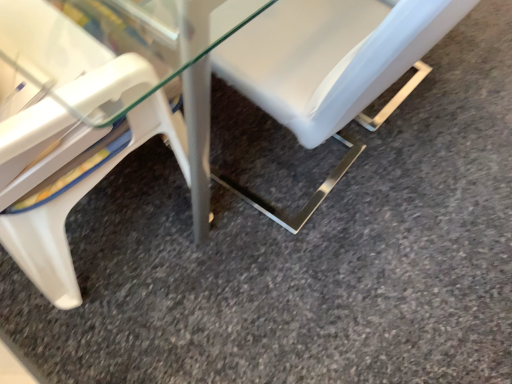
Describe the element at coordinates (68, 179) in the screenshot. The width and height of the screenshot is (512, 384). I see `white plastic chair at lower left, the 2th chair in the right-to-left sequence` at that location.

Identify the location of white plastic chair at lower left, which is the 1th chair from left to right. (68, 179).

Where is `white plastic chair at center, which is the first chair in right-to-left order`? The image size is (512, 384). white plastic chair at center, which is the first chair in right-to-left order is located at coordinates (330, 69).

The image size is (512, 384). Describe the element at coordinates (330, 69) in the screenshot. I see `white plastic chair at center, which is the first chair in right-to-left order` at that location.

The width and height of the screenshot is (512, 384). In order to click on white plastic chair at lower left, the 2th chair in the right-to-left sequence in this screenshot , I will do `click(68, 179)`.

Based on the photo, between white plastic chair at lower left, the 2th chair in the right-to-left sequence, and white plastic chair at center, the 2th chair viewed from the left, which one appears on the right side from the viewer's perspective?

Positioned to the right is white plastic chair at center, the 2th chair viewed from the left.

Considering the relative positions of white plastic chair at lower left, which is the 1th chair from left to right, and white plastic chair at center, which is the first chair in right-to-left order, in the image provided, is white plastic chair at lower left, which is the 1th chair from left to right, behind white plastic chair at center, which is the first chair in right-to-left order,?

No, it is in front of white plastic chair at center, which is the first chair in right-to-left order.

Between point (64, 109) and point (411, 7), which one is positioned in front?

The point (64, 109) is more forward.

From the image's perspective, is white plastic chair at lower left, which is the 1th chair from left to right, under white plastic chair at center, the 2th chair viewed from the left?

Indeed, from the image's perspective, white plastic chair at lower left, which is the 1th chair from left to right, is shown beneath white plastic chair at center, the 2th chair viewed from the left.

From a real-world perspective, which object rests below the other?

white plastic chair at center, which is the first chair in right-to-left order, from a real-world perspective.

Considering the relative sizes of white plastic chair at lower left, the 2th chair in the right-to-left sequence, and white plastic chair at center, which is the first chair in right-to-left order, in the image provided, is white plastic chair at lower left, the 2th chair in the right-to-left sequence, wider than white plastic chair at center, which is the first chair in right-to-left order,?

No.

Is white plastic chair at lower left, which is the 1th chair from left to right, taller than white plastic chair at center, which is the first chair in right-to-left order?

Correct, white plastic chair at lower left, which is the 1th chair from left to right, is much taller as white plastic chair at center, which is the first chair in right-to-left order.

Considering the sizes of objects white plastic chair at lower left, the 2th chair in the right-to-left sequence, and white plastic chair at center, the 2th chair viewed from the left, in the image provided, who is smaller, white plastic chair at lower left, the 2th chair in the right-to-left sequence, or white plastic chair at center, the 2th chair viewed from the left,?

white plastic chair at center, the 2th chair viewed from the left, is smaller.

Does white plastic chair at lower left, the 2th chair in the right-to-left sequence, contain white plastic chair at center, the 2th chair viewed from the left?

Actually, white plastic chair at center, the 2th chair viewed from the left, is outside white plastic chair at lower left, the 2th chair in the right-to-left sequence.

Is white plastic chair at lower left, the 2th chair in the right-to-left sequence, next to white plastic chair at center, the 2th chair viewed from the left?

No, white plastic chair at lower left, the 2th chair in the right-to-left sequence, is not in contact with white plastic chair at center, the 2th chair viewed from the left.

Is white plastic chair at lower left, which is the 1th chair from left to right, looking in the opposite direction of white plastic chair at center, which is the first chair in right-to-left order?

white plastic chair at lower left, which is the 1th chair from left to right, is not turned away from white plastic chair at center, which is the first chair in right-to-left order.

How many degrees apart are the facing directions of white plastic chair at lower left, the 2th chair in the right-to-left sequence, and white plastic chair at center, the 2th chair viewed from the left?

The facing directions of white plastic chair at lower left, the 2th chair in the right-to-left sequence, and white plastic chair at center, the 2th chair viewed from the left, are 93.3 degrees apart.

Where is `chair below the white plastic chair at center, the 2th chair viewed from the left (from the image's perspective)`? Image resolution: width=512 pixels, height=384 pixels. chair below the white plastic chair at center, the 2th chair viewed from the left (from the image's perspective) is located at coordinates (68, 179).

Which is more to the right, white plastic chair at center, which is the first chair in right-to-left order, or white plastic chair at lower left, which is the 1th chair from left to right?

white plastic chair at center, which is the first chair in right-to-left order, is more to the right.

Between white plastic chair at center, which is the first chair in right-to-left order, and white plastic chair at lower left, the 2th chair in the right-to-left sequence, which one is positioned behind?

white plastic chair at center, which is the first chair in right-to-left order.

Considering the points (321, 128) and (82, 127), which point is in front, point (321, 128) or point (82, 127)?

Point (82, 127)

From the image's perspective, which object appears higher, white plastic chair at center, which is the first chair in right-to-left order, or white plastic chair at lower left, the 2th chair in the right-to-left sequence?

white plastic chair at center, which is the first chair in right-to-left order, is shown above in the image.

From a real-world perspective, does white plastic chair at center, which is the first chair in right-to-left order, sit lower than white plastic chair at lower left, the 2th chair in the right-to-left sequence?

Indeed, from a real-world perspective, white plastic chair at center, which is the first chair in right-to-left order, is positioned beneath white plastic chair at lower left, the 2th chair in the right-to-left sequence.

Considering the relative sizes of white plastic chair at center, the 2th chair viewed from the left, and white plastic chair at lower left, the 2th chair in the right-to-left sequence, in the image provided, is white plastic chair at center, the 2th chair viewed from the left, wider than white plastic chair at lower left, the 2th chair in the right-to-left sequence,?

Yes.

Which of these two, white plastic chair at center, the 2th chair viewed from the left, or white plastic chair at lower left, which is the 1th chair from left to right, stands taller?

white plastic chair at lower left, which is the 1th chair from left to right, is taller.

Is white plastic chair at center, which is the first chair in right-to-left order, bigger or smaller than white plastic chair at lower left, the 2th chair in the right-to-left sequence?

In the image, white plastic chair at center, which is the first chair in right-to-left order, appears to be smaller than white plastic chair at lower left, the 2th chair in the right-to-left sequence.

Is white plastic chair at center, the 2th chair viewed from the left, completely or partially outside of white plastic chair at lower left, the 2th chair in the right-to-left sequence?

white plastic chair at center, the 2th chair viewed from the left, lies outside white plastic chair at lower left, the 2th chair in the right-to-left sequence,'s area.

Is white plastic chair at lower left, the 2th chair in the right-to-left sequence, at the back of white plastic chair at center, the 2th chair viewed from the left?

No.

How different are the orientations of white plastic chair at center, the 2th chair viewed from the left, and white plastic chair at lower left, the 2th chair in the right-to-left sequence, in degrees?

The angle between the facing direction of white plastic chair at center, the 2th chair viewed from the left, and the facing direction of white plastic chair at lower left, the 2th chair in the right-to-left sequence, is 93.3 degrees.

Measure the distance between white plastic chair at center, which is the first chair in right-to-left order, and white plastic chair at lower left, the 2th chair in the right-to-left sequence.

The distance of white plastic chair at center, which is the first chair in right-to-left order, from white plastic chair at lower left, the 2th chair in the right-to-left sequence, is 12.21 inches.

Locate an element on the screen. This screenshot has height=384, width=512. chair behind the white plastic chair at lower left, which is the 1th chair from left to right is located at coordinates (x=330, y=69).

Find the location of a particular element. This screenshot has height=384, width=512. chair that appears on the left of white plastic chair at center, which is the first chair in right-to-left order is located at coordinates (68, 179).

Identify the location of chair located below the white plastic chair at center, which is the first chair in right-to-left order (from the image's perspective). This screenshot has height=384, width=512. (68, 179).